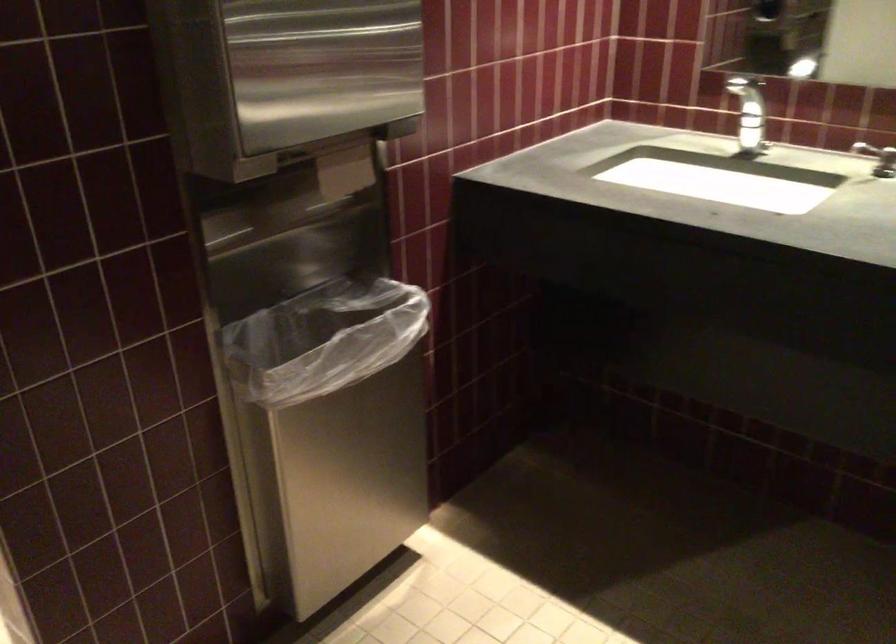
Where is `silver faucet handle`? Image resolution: width=896 pixels, height=644 pixels. silver faucet handle is located at coordinates pyautogui.click(x=748, y=116).